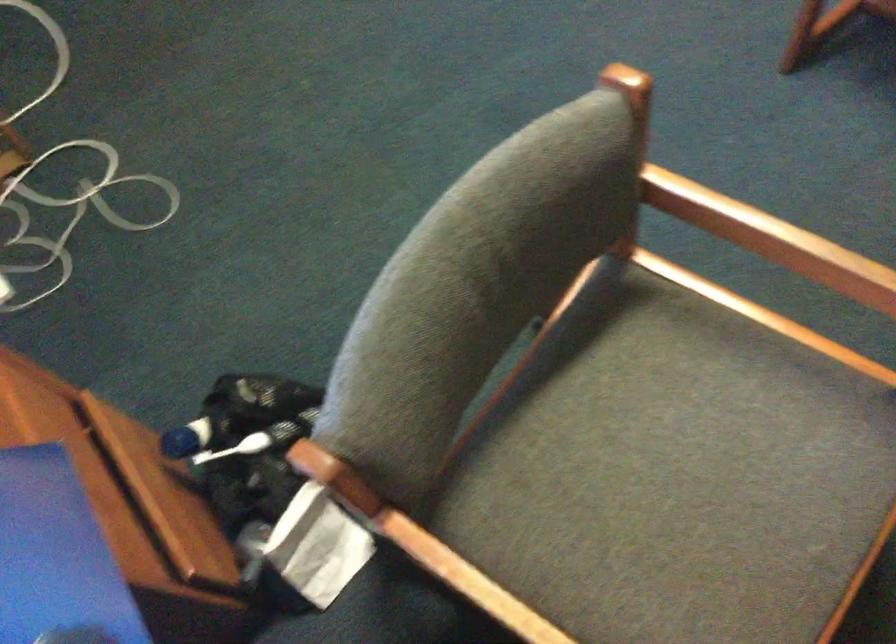
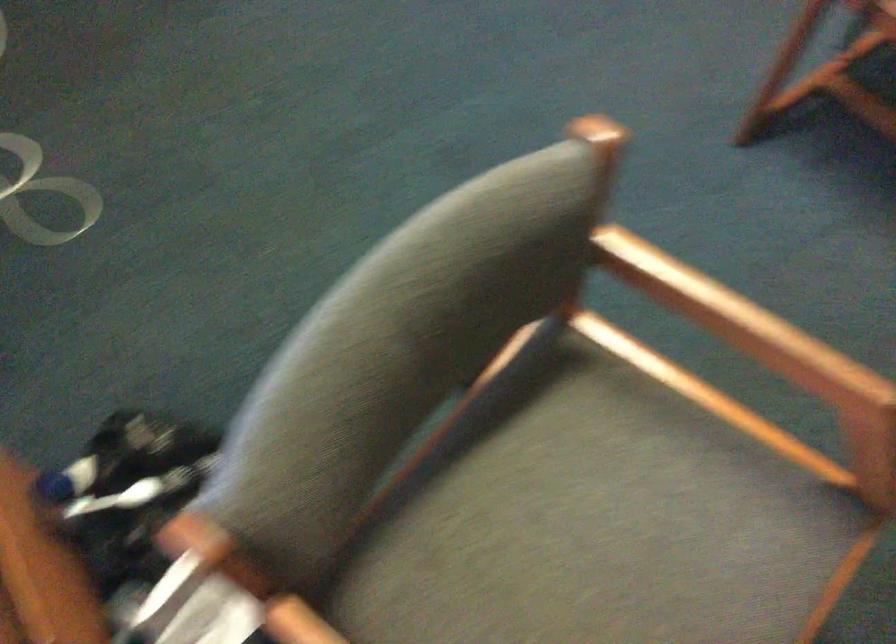
Question: What movement of the cameraman would produce the second image?

Choices:
 (A) Left
 (B) Right
 (C) Forward
 (D) Backward

Answer: (C)